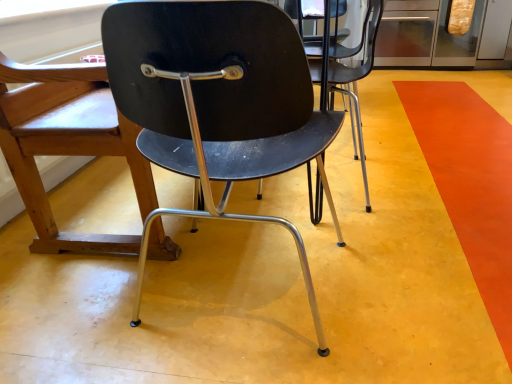
Question: Considering the relative positions of orange matte floor at lower right and matte black chair at center, which is the 1th chair in back-to-front order, in the image provided, is orange matte floor at lower right behind matte black chair at center, which is the 1th chair in back-to-front order,?

Choices:
 (A) yes
 (B) no

Answer: (B)

Question: Is orange matte floor at lower right not within matte black chair at center, the 2th chair when ordered from front to back?

Choices:
 (A) no
 (B) yes

Answer: (B)

Question: Is orange matte floor at lower right positioned in front of matte black chair at center, which is the 1th chair in back-to-front order?

Choices:
 (A) yes
 (B) no

Answer: (A)

Question: Is orange matte floor at lower right at the left side of matte black chair at center, which is the 1th chair in back-to-front order?

Choices:
 (A) yes
 (B) no

Answer: (B)

Question: From the image's perspective, is orange matte floor at lower right above matte black chair at center, the 2th chair when ordered from front to back?

Choices:
 (A) yes
 (B) no

Answer: (B)

Question: Considering their positions, is matte black chair at center, the 2th chair from the back, located in front of or behind orange matte floor at lower right?

Choices:
 (A) behind
 (B) front

Answer: (B)

Question: Is matte black chair at center, the 1th chair viewed from the front, wider or thinner than orange matte floor at lower right?

Choices:
 (A) thin
 (B) wide

Answer: (A)

Question: From the image's perspective, is matte black chair at center, the 2th chair from the back, located above or below orange matte floor at lower right?

Choices:
 (A) above
 (B) below

Answer: (B)

Question: Would you say matte black chair at center, the 1th chair viewed from the front, is inside or outside orange matte floor at lower right?

Choices:
 (A) outside
 (B) inside

Answer: (A)

Question: From the image's perspective, relative to matte black chair at center, which is the 1th chair in back-to-front order, is matte black chair at center, the 1th chair viewed from the front, above or below?

Choices:
 (A) below
 (B) above

Answer: (A)

Question: Considering the positions of point (198, 11) and point (12, 96), is point (198, 11) closer or farther from the camera than point (12, 96)?

Choices:
 (A) closer
 (B) farther

Answer: (A)

Question: Is matte black chair at center, the 2th chair from the back, inside the boundaries of matte black chair at center, the 2th chair when ordered from front to back, or outside?

Choices:
 (A) inside
 (B) outside

Answer: (B)

Question: Visually, is matte black chair at center, the 2th chair from the back, positioned to the left or to the right of matte black chair at center, the 2th chair when ordered from front to back?

Choices:
 (A) right
 (B) left

Answer: (A)

Question: From a real-world perspective, relative to matte black chair at center, which is the 1th chair in back-to-front order, is orange matte floor at lower right vertically above or below?

Choices:
 (A) above
 (B) below

Answer: (B)

Question: Visually, is orange matte floor at lower right positioned to the left or to the right of matte black chair at center, which is the 1th chair in back-to-front order?

Choices:
 (A) left
 (B) right

Answer: (B)